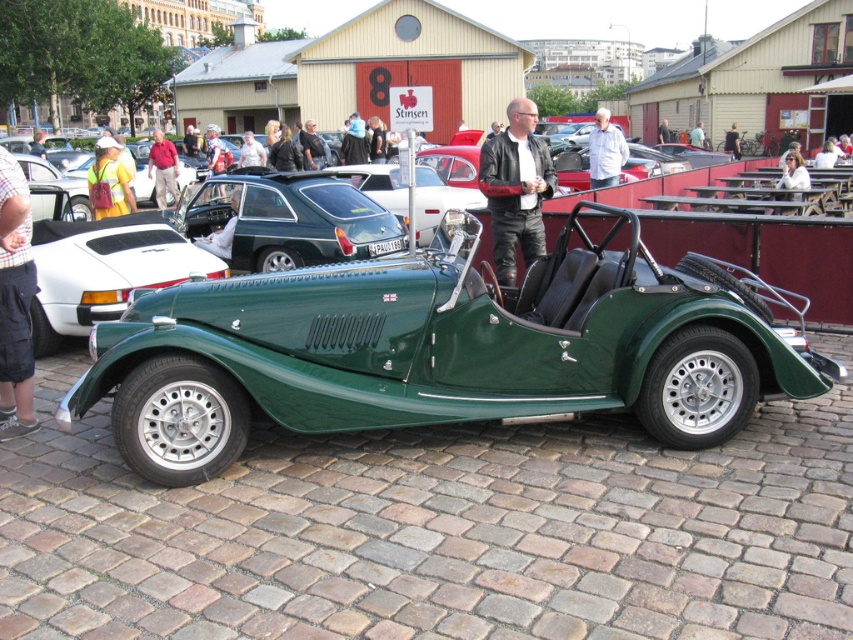
Can you confirm if plaid shirt at left is positioned below reflective yellow safety vest at left?

Yes.

Can you confirm if plaid shirt at left is positioned to the left of reflective yellow safety vest at left?

In fact, plaid shirt at left is to the right of reflective yellow safety vest at left.

Where is `plaid shirt at left`? This screenshot has height=640, width=853. plaid shirt at left is located at coordinates (15, 301).

This screenshot has width=853, height=640. Find the location of `plaid shirt at left`. plaid shirt at left is located at coordinates (15, 301).

Is white leather jacket at upper center shorter than dark gray leather jacket at center?

Yes, white leather jacket at upper center is shorter than dark gray leather jacket at center.

You are a GUI agent. You are given a task and a screenshot of the screen. Output one action in this format:
    pyautogui.click(x=<x>, y=<y>)
    Task: Click on the white leather jacket at upper center
    The height and width of the screenshot is (640, 853).
    Given the screenshot: What is the action you would take?
    pyautogui.click(x=605, y=150)

Describe the element at coordinates (605, 150) in the screenshot. Image resolution: width=853 pixels, height=640 pixels. I see `white leather jacket at upper center` at that location.

At what (x,y) coordinates should I click in order to perform the action: click on white leather jacket at upper center. Please return your answer as a coordinate pair (x, y). Image resolution: width=853 pixels, height=640 pixels. Looking at the image, I should click on (605, 150).

Image resolution: width=853 pixels, height=640 pixels. What do you see at coordinates (444, 349) in the screenshot?
I see `green matte convertible at center` at bounding box center [444, 349].

Between green matte convertible at center and dark gray leather jacket at center, which one has more height?

dark gray leather jacket at center

The width and height of the screenshot is (853, 640). Find the location of `green matte convertible at center`. green matte convertible at center is located at coordinates (444, 349).

Locate an element on the screen. The width and height of the screenshot is (853, 640). green matte convertible at center is located at coordinates (444, 349).